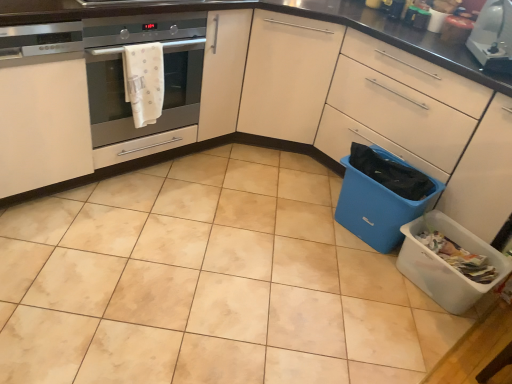
Where is `beige glossy tile at center`? beige glossy tile at center is located at coordinates (208, 282).

You are a GUI agent. You are given a task and a screenshot of the screen. Output one action in this format:
    pyautogui.click(x=<x>, y=<y>)
    Task: Click on the blue plastic bin at lower right, the first material when ordered from bottom to top
    This screenshot has width=512, height=384.
    Given the screenshot: What is the action you would take?
    pyautogui.click(x=390, y=173)

Measure the distance between satin silver oven at left and camera.

The depth of satin silver oven at left is 5.41 feet.

Identify the location of white matte cabinet at left, acting as the first cabinetry starting from the left. (42, 107).

Is the position of white matte cabinet at left, marked as the second cabinetry in a right-to-left arrangement, more distant than that of white glossy toaster at upper right?

No, white matte cabinet at left, marked as the second cabinetry in a right-to-left arrangement, is in front of white glossy toaster at upper right.

Could you measure the distance between white matte cabinet at left, marked as the second cabinetry in a right-to-left arrangement, and white glossy toaster at upper right?

6.00 feet.

Looking at this image, from the image's perspective, is white matte cabinet at left, marked as the second cabinetry in a right-to-left arrangement, located above white glossy toaster at upper right?

No, from the image's perspective, white matte cabinet at left, marked as the second cabinetry in a right-to-left arrangement, is not on top of white glossy toaster at upper right.

Are white matte cabinet at left, acting as the first cabinetry starting from the left, and white glossy toaster at upper right far apart?

Yes.

Can you confirm if white plastic recycling bin at lower right, positioned as the 2th recycling bin in top-to-bottom order, is positioned to the right of blue plastic recycling bin at lower right, marked as the second recycling bin in a bottom-to-top arrangement?

Yes, white plastic recycling bin at lower right, positioned as the 2th recycling bin in top-to-bottom order, is to the right of blue plastic recycling bin at lower right, marked as the second recycling bin in a bottom-to-top arrangement.

From the image's perspective, is white plastic recycling bin at lower right, positioned as the 2th recycling bin in top-to-bottom order, on top of blue plastic recycling bin at lower right, marked as the second recycling bin in a bottom-to-top arrangement?

No, from the image's perspective, white plastic recycling bin at lower right, positioned as the 2th recycling bin in top-to-bottom order, is not on top of blue plastic recycling bin at lower right, marked as the second recycling bin in a bottom-to-top arrangement.

Is point (423, 257) closer or farther from the camera than point (346, 185)?

Point (423, 257) appears to be closer to the viewer than point (346, 185).

Considering the sizes of objects white plastic recycling bin at lower right, positioned as the 2th recycling bin in top-to-bottom order, and blue plastic recycling bin at lower right, the first recycling bin positioned from the top, in the image provided, who is smaller, white plastic recycling bin at lower right, positioned as the 2th recycling bin in top-to-bottom order, or blue plastic recycling bin at lower right, the first recycling bin positioned from the top,?

Smaller between the two is white plastic recycling bin at lower right, positioned as the 2th recycling bin in top-to-bottom order.

Which object is thinner, blue plastic bin at lower right, the 2th material viewed from the left, or matte white cabinet at center, which is the 2th cabinetry from left to right?

With smaller width is blue plastic bin at lower right, the 2th material viewed from the left.

Is blue plastic bin at lower right, the first material when ordered from bottom to top, positioned with its back to matte white cabinet at center, the 1th cabinetry viewed from the right?

Yes.

From the image's perspective, does blue plastic bin at lower right, the first material positioned from the right, appear higher than matte white cabinet at center, which is the 2th cabinetry from left to right?

Indeed, from the image's perspective, blue plastic bin at lower right, the first material positioned from the right, is shown above matte white cabinet at center, which is the 2th cabinetry from left to right.

Which object is further away from the camera taking this photo, blue plastic bin at lower right, which is the 2th material in top-to-bottom order, or matte white cabinet at center, the 1th cabinetry viewed from the right?

blue plastic bin at lower right, which is the 2th material in top-to-bottom order, is more distant.

Considering the sizes of objects blue plastic recycling bin at lower right, the first recycling bin positioned from the top, and beige glossy tile at center in the image provided, who is wider, blue plastic recycling bin at lower right, the first recycling bin positioned from the top, or beige glossy tile at center?

With larger width is beige glossy tile at center.

From a real-world perspective, which object stands above the other?

blue plastic recycling bin at lower right, marked as the second recycling bin in a bottom-to-top arrangement.

Does blue plastic recycling bin at lower right, marked as the second recycling bin in a bottom-to-top arrangement, have a greater height compared to beige glossy tile at center?

Indeed, blue plastic recycling bin at lower right, marked as the second recycling bin in a bottom-to-top arrangement, has a greater height compared to beige glossy tile at center.

Considering the relative positions of blue plastic recycling bin at lower right, the first recycling bin positioned from the top, and beige glossy tile at center in the image provided, is blue plastic recycling bin at lower right, the first recycling bin positioned from the top, to the left of beige glossy tile at center from the viewer's perspective?

Incorrect, blue plastic recycling bin at lower right, the first recycling bin positioned from the top, is not on the left side of beige glossy tile at center.

Considering the relative sizes of blue plastic recycling bin at lower right, the first recycling bin positioned from the top, and blue plastic bin at lower right, which is the 2th material in top-to-bottom order, in the image provided, is blue plastic recycling bin at lower right, the first recycling bin positioned from the top, bigger than blue plastic bin at lower right, which is the 2th material in top-to-bottom order,?

Indeed, blue plastic recycling bin at lower right, the first recycling bin positioned from the top, has a larger size compared to blue plastic bin at lower right, which is the 2th material in top-to-bottom order.

Between point (348, 212) and point (378, 168), which one is positioned behind?

The point (348, 212) is farther from the camera.

In the scene shown: Can you confirm if blue plastic recycling bin at lower right, the first recycling bin positioned from the top, is positioned to the right of blue plastic bin at lower right, the 2th material viewed from the left?

In fact, blue plastic recycling bin at lower right, the first recycling bin positioned from the top, is to the left of blue plastic bin at lower right, the 2th material viewed from the left.

From a real-world perspective, is beige glossy tile at center positioned above or below blue plastic bin at lower right, the 2th material viewed from the left?

beige glossy tile at center is below blue plastic bin at lower right, the 2th material viewed from the left.

I want to click on ceramic tile lying in front of the blue plastic bin at lower right, which is the 2th material in top-to-bottom order, so click(x=208, y=282).

Is beige glossy tile at center facing away from blue plastic bin at lower right, which is the 2th material in top-to-bottom order?

No, beige glossy tile at center's orientation is not away from blue plastic bin at lower right, which is the 2th material in top-to-bottom order.

Which is more distant, (400, 352) or (376, 175)?

Positioned behind is point (376, 175).

From a real-world perspective, who is located lower, white glossy toaster at upper right or white plastic recycling bin at lower right, which is the 1th recycling bin in bottom-to-top order?

white plastic recycling bin at lower right, which is the 1th recycling bin in bottom-to-top order.

From the picture: Is white glossy toaster at upper right positioned with its back to white plastic recycling bin at lower right, positioned as the 2th recycling bin in top-to-bottom order?

No, white plastic recycling bin at lower right, positioned as the 2th recycling bin in top-to-bottom order, is not at the back of white glossy toaster at upper right.

Where is `kitchen appliance above the white plastic recycling bin at lower right, which is the 1th recycling bin in bottom-to-top order (from the image's perspective)`? The image size is (512, 384). kitchen appliance above the white plastic recycling bin at lower right, which is the 1th recycling bin in bottom-to-top order (from the image's perspective) is located at coordinates (493, 35).

Locate an element on the screen. The width and height of the screenshot is (512, 384). kitchen appliance that appears above the white matte cabinet at left, acting as the first cabinetry starting from the left (from the image's perspective) is located at coordinates (493, 35).

The width and height of the screenshot is (512, 384). In order to click on recycling bin behind the white plastic recycling bin at lower right, positioned as the 2th recycling bin in top-to-bottom order in this screenshot , I will do `click(382, 196)`.

When comparing their distances from white glossy toaster at upper right, does white matte cabinet at left, marked as the second cabinetry in a right-to-left arrangement, or white plastic recycling bin at lower right, positioned as the 2th recycling bin in top-to-bottom order, seem further?

white matte cabinet at left, marked as the second cabinetry in a right-to-left arrangement, lies further to white glossy toaster at upper right than the other object.

From the picture: When comparing their distances from blue plastic bin at lower right, the first material when ordered from bottom to top, does white fabric towel at left, which is the second material in bottom-to-top order, or white plastic recycling bin at lower right, which is the 1th recycling bin in bottom-to-top order, seem further?

white fabric towel at left, which is the second material in bottom-to-top order, is positioned further to the anchor blue plastic bin at lower right, the first material when ordered from bottom to top.

Estimate the real-world distances between objects in this image. Which object is closer to blue plastic bin at lower right, the 2th material viewed from the left, blue plastic recycling bin at lower right, marked as the second recycling bin in a bottom-to-top arrangement, or white matte cabinet at left, acting as the first cabinetry starting from the left?

Based on the image, blue plastic recycling bin at lower right, marked as the second recycling bin in a bottom-to-top arrangement, appears to be nearer to blue plastic bin at lower right, the 2th material viewed from the left.

Which object lies further to the anchor point white fabric towel at left, the 1th material positioned from the top, white glossy toaster at upper right or beige glossy tile at center?

white glossy toaster at upper right is positioned further to the anchor white fabric towel at left, the 1th material positioned from the top.

Estimate the real-world distances between objects in this image. Which object is closer to beige glossy tile at center, matte white cabinet at center, the 1th cabinetry viewed from the right, or satin silver oven at left?

The object closer to beige glossy tile at center is matte white cabinet at center, the 1th cabinetry viewed from the right.

When comparing their distances from white fabric towel at left, the 1th material positioned from the top, does blue plastic bin at lower right, the first material when ordered from bottom to top, or white matte cabinet at left, acting as the first cabinetry starting from the left, seem closer?

Based on the image, white matte cabinet at left, acting as the first cabinetry starting from the left, appears to be nearer to white fabric towel at left, the 1th material positioned from the top.

Based on their spatial positions, is beige glossy tile at center or white fabric towel at left, the 1th material positioned from the top, further from blue plastic bin at lower right, which is the 2th material in top-to-bottom order?

white fabric towel at left, the 1th material positioned from the top, is further to blue plastic bin at lower right, which is the 2th material in top-to-bottom order.

When comparing their distances from satin silver oven at left, does white matte cabinet at left, marked as the second cabinetry in a right-to-left arrangement, or white fabric towel at left, the 1th material positioned from the top, seem further?

Based on the image, white matte cabinet at left, marked as the second cabinetry in a right-to-left arrangement, appears to be further to satin silver oven at left.

Locate an element on the screen. This screenshot has width=512, height=384. home appliance between beige glossy tile at center and white fabric towel at left, which is counted as the 2th material, starting from the right, along the z-axis is located at coordinates (123, 74).

Where is `home appliance between matte white cabinet at center, the 1th cabinetry viewed from the right, and white fabric towel at left, which is the second material in bottom-to-top order, in the front-back direction`? home appliance between matte white cabinet at center, the 1th cabinetry viewed from the right, and white fabric towel at left, which is the second material in bottom-to-top order, in the front-back direction is located at coordinates (123, 74).

Locate an element on the screen. Image resolution: width=512 pixels, height=384 pixels. cabinetry located between matte white cabinet at center, which is the 2th cabinetry from left to right, and white fabric towel at left, which is the second material in bottom-to-top order, in the depth direction is located at coordinates (42, 107).

You are a GUI agent. You are given a task and a screenshot of the screen. Output one action in this format:
    pyautogui.click(x=<x>, y=<y>)
    Task: Click on the ceramic tile positioned between matte white cabinet at center, the 1th cabinetry viewed from the right, and satin silver oven at left from near to far
    
    Given the screenshot: What is the action you would take?
    (x=208, y=282)